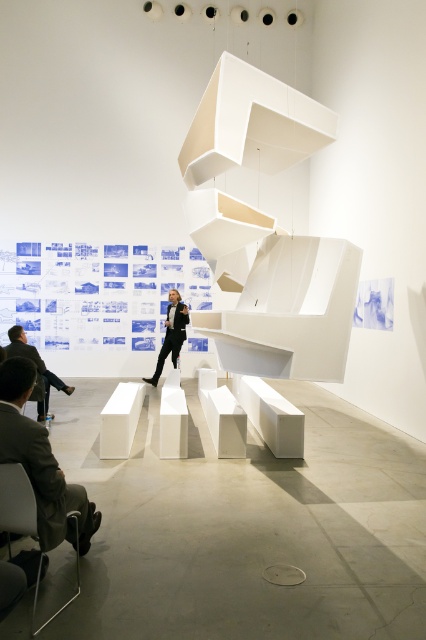
Question: Which object is closer to the camera taking this photo?

Choices:
 (A) matte black suit at lower left
 (B) metallic gray chair at lower left
 (C) dark gray suit at lower left

Answer: (B)

Question: Does dark gray suit at lower left appear under metallic gray chair at lower left?

Choices:
 (A) yes
 (B) no

Answer: (B)

Question: From the image, what is the correct spatial relationship of dark gray suit at lower left in relation to matte black suit at lower left?

Choices:
 (A) below
 (B) above

Answer: (A)

Question: Which is nearer to the matte black suit at lower left?

Choices:
 (A) metallic gray chair at lower left
 (B) dark gray suit at lower left
 (C) black suit at center

Answer: (C)

Question: Is metallic gray chair at lower left further to the viewer compared to black suit at center?

Choices:
 (A) yes
 (B) no

Answer: (B)

Question: Which object appears farthest from the camera in this image?

Choices:
 (A) metallic gray chair at lower left
 (B) black suit at center
 (C) matte black suit at lower left

Answer: (B)